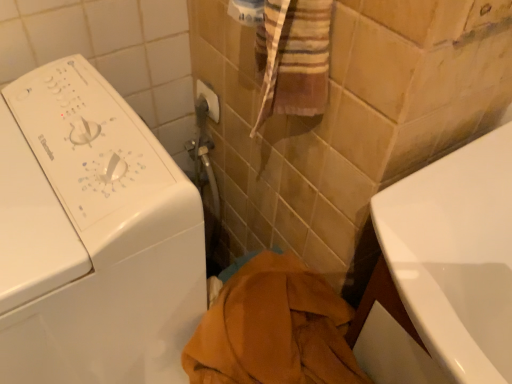
Question: Can we say brown cotton towel at center lies outside white glossy washing machine at left?

Choices:
 (A) no
 (B) yes

Answer: (B)

Question: From the image's perspective, is brown cotton towel at center beneath white glossy washing machine at left?

Choices:
 (A) no
 (B) yes

Answer: (B)

Question: From the image's perspective, is brown cotton towel at center on top of white glossy washing machine at left?

Choices:
 (A) yes
 (B) no

Answer: (B)

Question: Is brown cotton towel at center further to the viewer compared to white glossy washing machine at left?

Choices:
 (A) no
 (B) yes

Answer: (B)

Question: Is brown cotton towel at center facing towards white glossy washing machine at left?

Choices:
 (A) yes
 (B) no

Answer: (B)

Question: Does brown cotton towel at center have a lesser height compared to white glossy washing machine at left?

Choices:
 (A) yes
 (B) no

Answer: (A)

Question: Is white plastic towel bar at upper center at the right side of white glossy bathtub at lower right?

Choices:
 (A) yes
 (B) no

Answer: (B)

Question: Is white plastic towel bar at upper center not near white glossy bathtub at lower right?

Choices:
 (A) yes
 (B) no

Answer: (B)

Question: Can white glossy bathtub at lower right be found inside white plastic towel bar at upper center?

Choices:
 (A) yes
 (B) no

Answer: (B)

Question: From a real-world perspective, is white plastic towel bar at upper center positioned over white glossy bathtub at lower right based on gravity?

Choices:
 (A) no
 (B) yes

Answer: (B)

Question: From the image's perspective, is white plastic towel bar at upper center under white glossy bathtub at lower right?

Choices:
 (A) yes
 (B) no

Answer: (B)

Question: Does white plastic towel bar at upper center come behind white glossy bathtub at lower right?

Choices:
 (A) no
 (B) yes

Answer: (B)

Question: Is white glossy washing machine at left to the right of white plastic towel bar at upper center from the viewer's perspective?

Choices:
 (A) yes
 (B) no

Answer: (B)